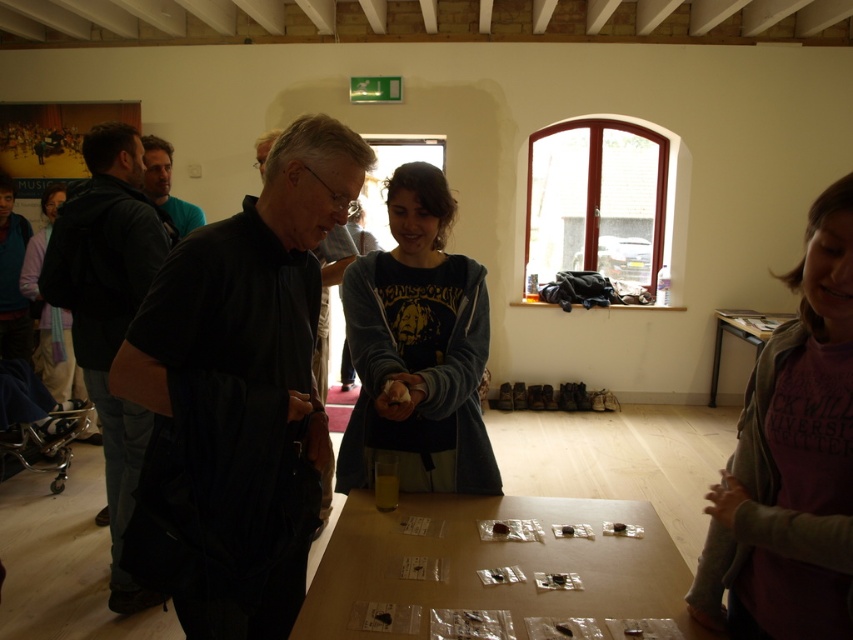
Between point (218, 531) and point (363, 544), which one is positioned behind?

Positioned behind is point (363, 544).

Where is `dark matte shirt at center`? dark matte shirt at center is located at coordinates (238, 396).

Is clear plastic table at center positioned before dark gray sweatshirt at center?

Yes, clear plastic table at center is in front of dark gray sweatshirt at center.

Between clear plastic table at center and dark gray sweatshirt at center, which one has more height?

dark gray sweatshirt at center is taller.

Is point (685, 625) farther from viewer compared to point (349, 461)?

No.

You are a GUI agent. You are given a task and a screenshot of the screen. Output one action in this format:
    pyautogui.click(x=<x>, y=<y>)
    Task: Click on the clear plastic table at center
    The height and width of the screenshot is (640, 853).
    Given the screenshot: What is the action you would take?
    point(491,564)

Who is higher up, dark matte shirt at center or purple cotton shirt at lower right?

dark matte shirt at center

Can you confirm if dark matte shirt at center is shorter than purple cotton shirt at lower right?

No.

Does point (219, 577) come behind point (810, 253)?

Yes.

The width and height of the screenshot is (853, 640). Identify the location of dark matte shirt at center. (238, 396).